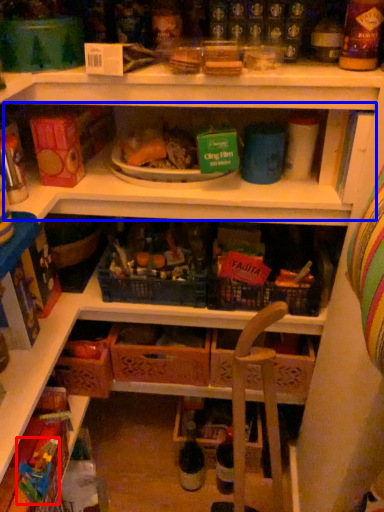
Question: Which object is further to the camera taking this photo, toy (highlighted by a red box) or shelf (highlighted by a blue box)?

Choices:
 (A) toy
 (B) shelf

Answer: (B)